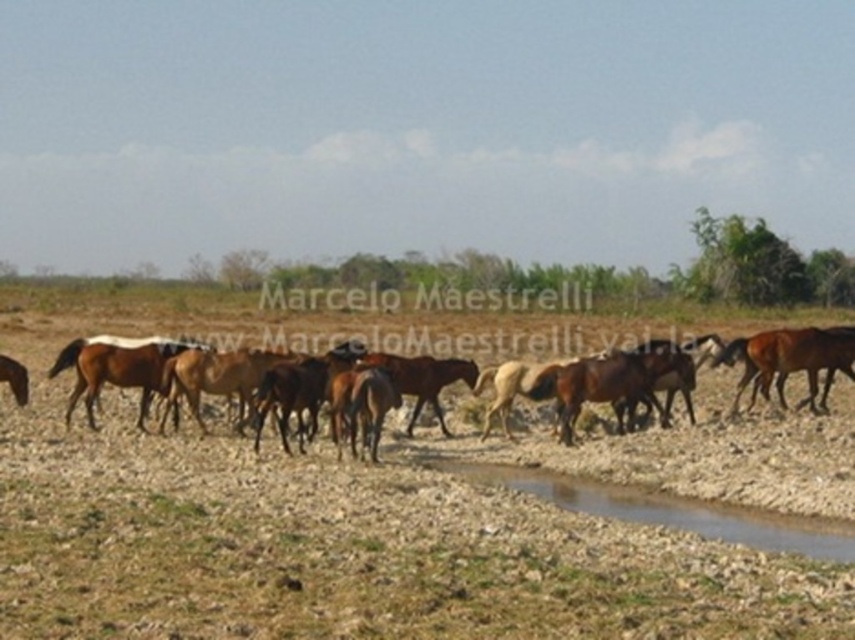
Question: Which point is closer to the camera?

Choices:
 (A) brown glossy horse at left
 (B) brown glossy horse at right
 (C) brown gravel puddle at lower center

Answer: (C)

Question: Considering the real-world distances, which object is farthest from the brown gravel puddle at lower center?

Choices:
 (A) brown glossy horse at right
 (B) brown glossy horse at center
 (C) brown glossy horse at left

Answer: (B)

Question: Which is farther from the brown glossy horse at center?

Choices:
 (A) brown glossy horse at right
 (B) brown glossy horse at left

Answer: (A)

Question: Can you confirm if brown glossy horse at right is thinner than brown glossy horse at center?

Choices:
 (A) no
 (B) yes

Answer: (A)

Question: Can you confirm if brown gravel puddle at lower center is positioned to the left of brown glossy horse at right?

Choices:
 (A) no
 (B) yes

Answer: (B)

Question: Does brown gravel puddle at lower center have a lesser width compared to brown glossy horse at left?

Choices:
 (A) no
 (B) yes

Answer: (A)